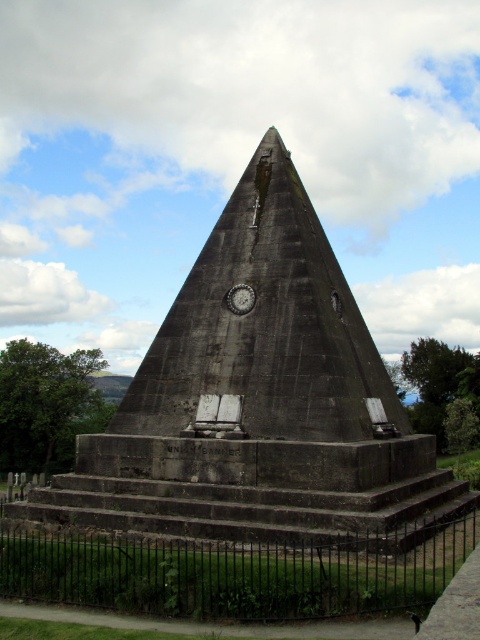
Question: Is dark gray stone monument at center thinner than black wrought iron fence at lower center?

Choices:
 (A) no
 (B) yes

Answer: (A)

Question: Which point appears farthest from the camera in this image?

Choices:
 (A) (36, 592)
 (B) (387, 490)

Answer: (B)

Question: Which point is closer to the camera?

Choices:
 (A) dark gray stone monument at center
 (B) black wrought iron fence at lower center

Answer: (B)

Question: Is dark gray stone monument at center further to the viewer compared to black wrought iron fence at lower center?

Choices:
 (A) no
 (B) yes

Answer: (B)

Question: Can you confirm if dark gray stone monument at center is bigger than black wrought iron fence at lower center?

Choices:
 (A) yes
 (B) no

Answer: (A)